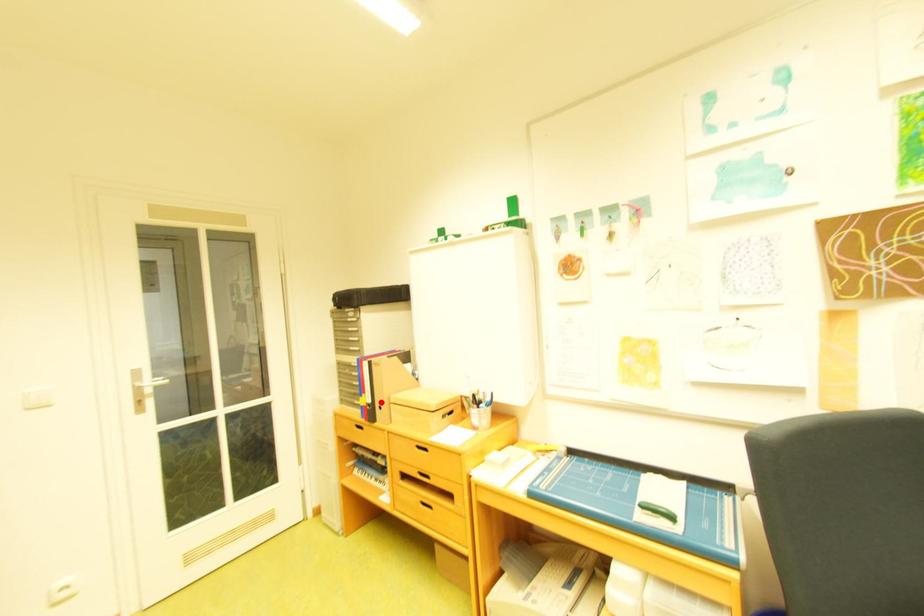
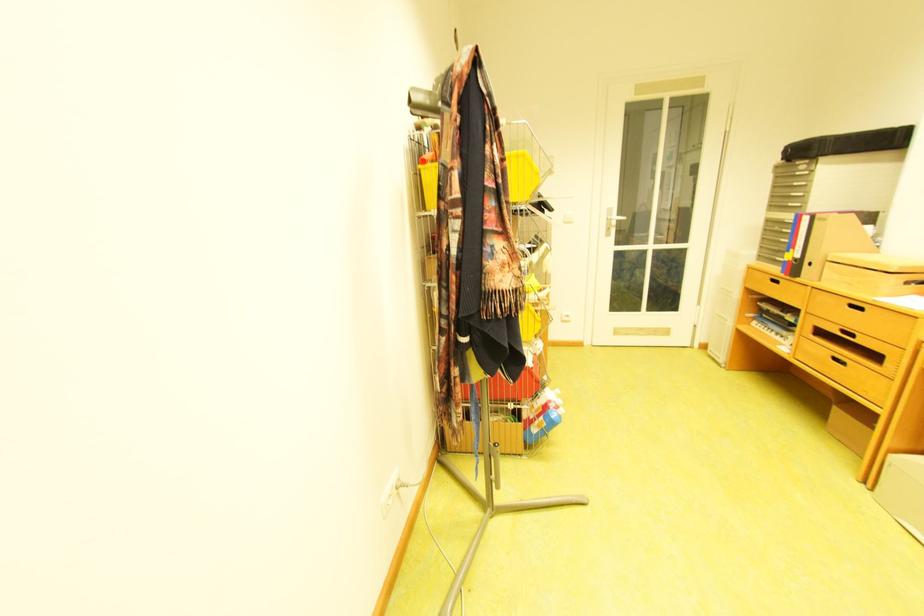
Find the pixel in the second image that matches the highlighted location in the first image.

(809, 257)